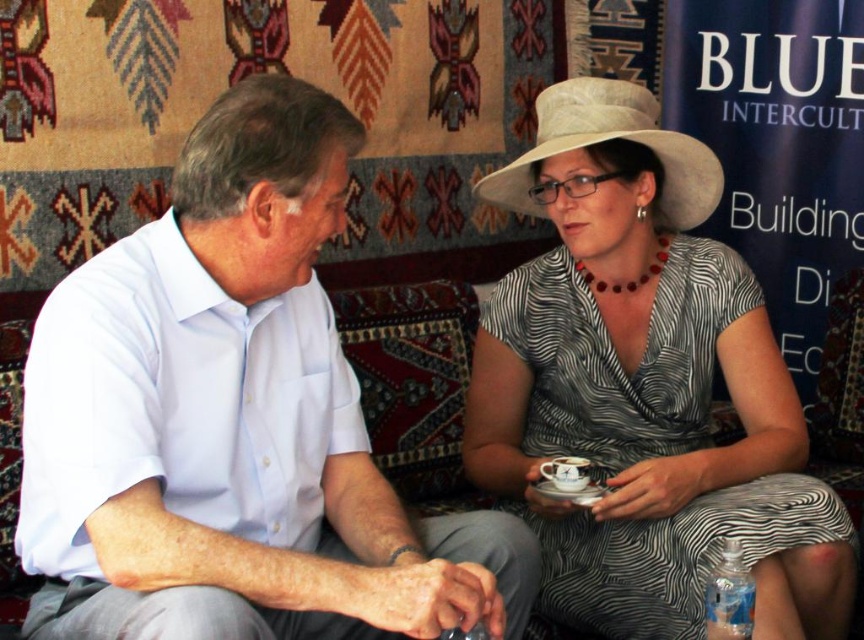
You are a photographer setting up a shoot in the scene. You need to place a light source so that it illuminates both the beige straw hat at upper right and the clear plastic bottle at lower right equally. Considering their heights, where should you position the light source?

The beige straw hat at upper right is taller than the clear plastic bottle at lower right. To ensure both receive equal illumination, position the light source at a lower angle so that the light reaches the top of the taller hat while also covering the shorter bottle adequately.

You are a photographer taking a portrait of the two people on the couch. You notice the white textured hat at upper right and the beige straw hat at upper right. Which hat should you adjust to ensure both are fully visible in the photo?

You should adjust the beige straw hat at upper right because the white textured hat at upper right is in front of it, partially blocking the view. Moving the beige straw hat slightly backward or repositioning it could help both hats become fully visible in the photo.

You are a photographer taking a picture of the scene. You want to focus on the white textured hat at upper right and clear plastic bottle at lower right. Which object should you adjust your camera focus on first to ensure it appears sharp?

The white textured hat at upper right is closer to the viewer than the clear plastic bottle at lower right, so you should focus on the white textured hat at upper right first.